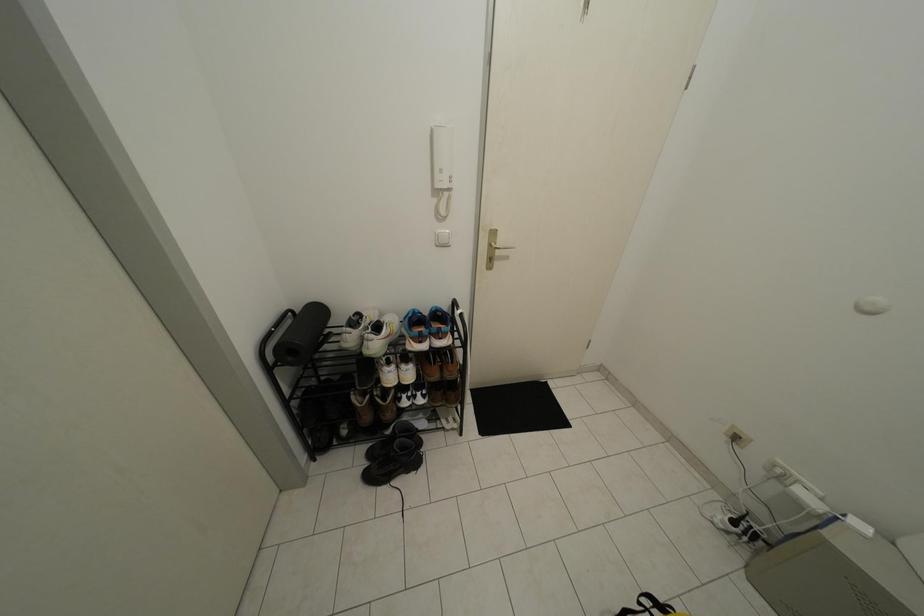
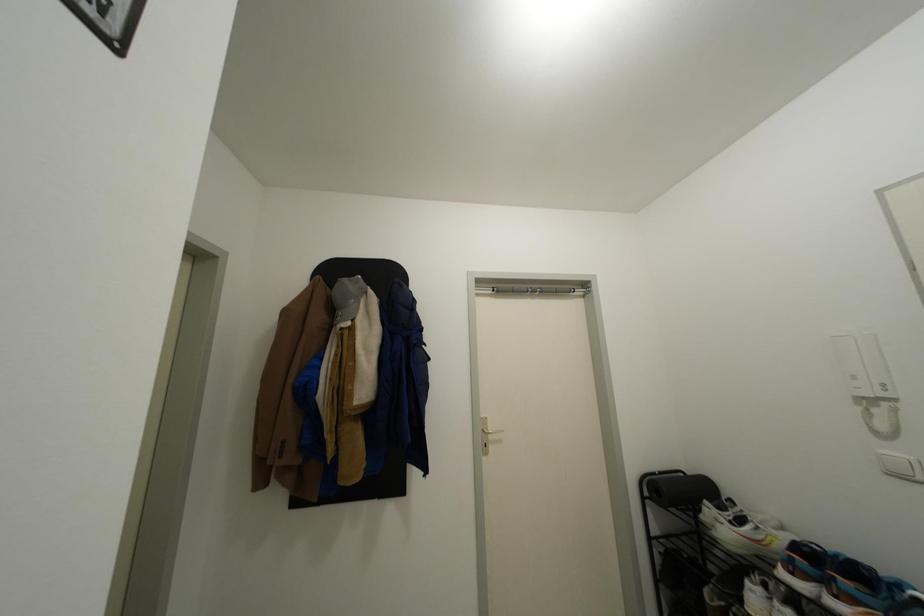
Question: The camera is either moving clockwise (left) or counter-clockwise (right) around the object. The first image is from the beginning of the video and the second image is from the end. Is the camera moving left or right when shooting the video?

Choices:
 (A) Left
 (B) Right

Answer: (B)